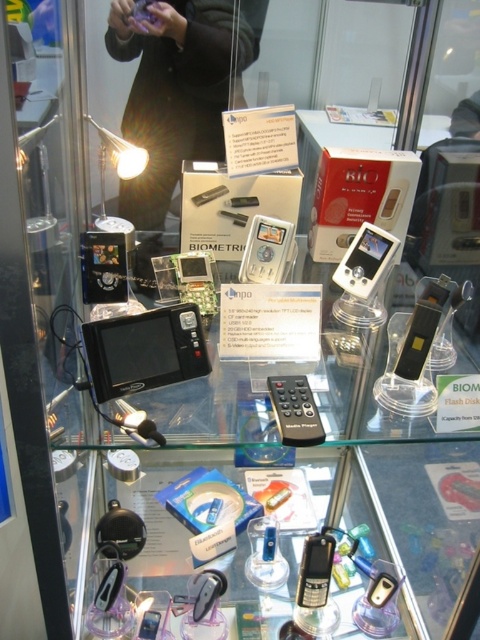
You are an electronics technician inspecting the display case. You need to place a new accessory between the matte black camera at upper center and the black plastic usb flash drive at center. Which side of the accessory should face the wider object?

The matte black camera at upper center has a larger width than the black plastic usb flash drive at center. Therefore, the accessory should be placed so that its side facing the matte black camera at upper center aligns with the wider object.

Consider the image. You are a security guard at the exhibition and need to determine if the metallic black usb flash drive at center can be placed on top of the clear plastic phone at lower center without exceeding the display case height limit. Can it fit?

The metallic black usb flash drive at center is much taller than the clear plastic phone at lower center, so placing it on top would exceed the display case height limit.